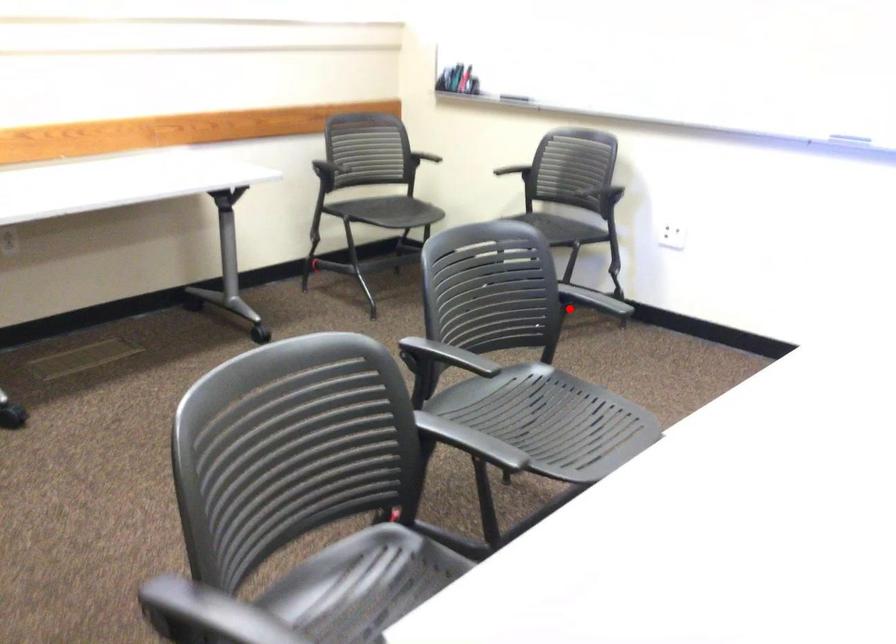
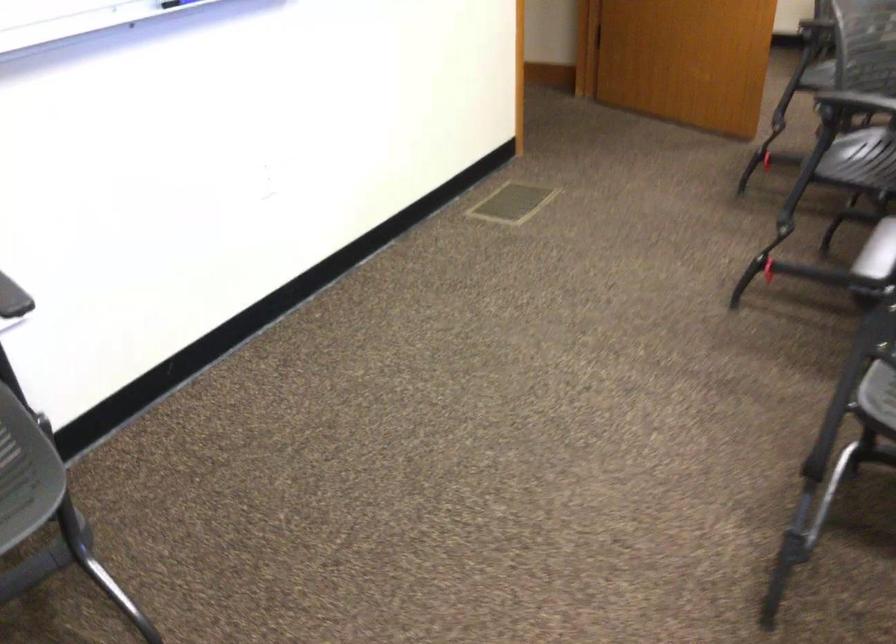
Where in the second image is the point corresponding to the highlighted location from the first image?

(876, 252)